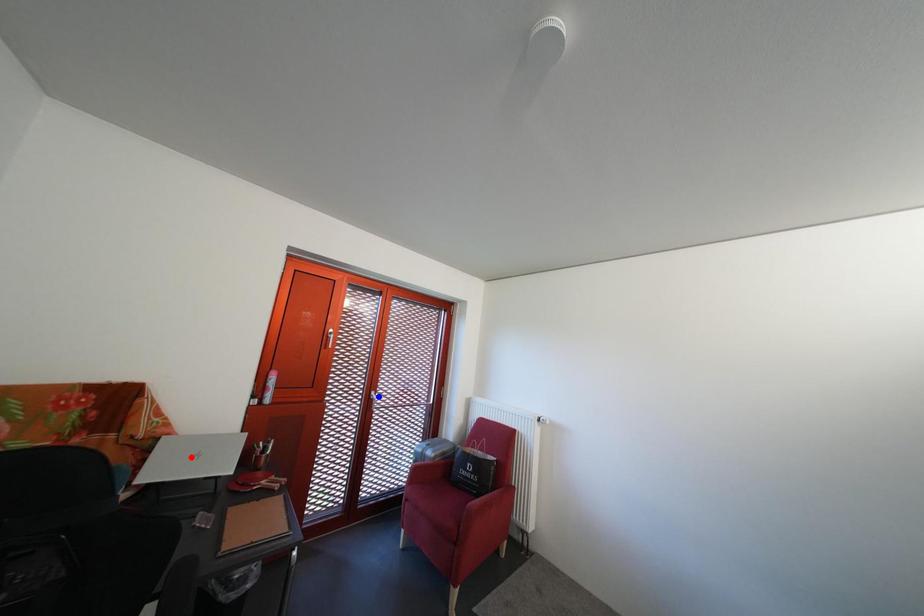
Question: Which of the two points in the image is closer to the camera?

Choices:
 (A) Blue point is closer.
 (B) Red point is closer.

Answer: (B)